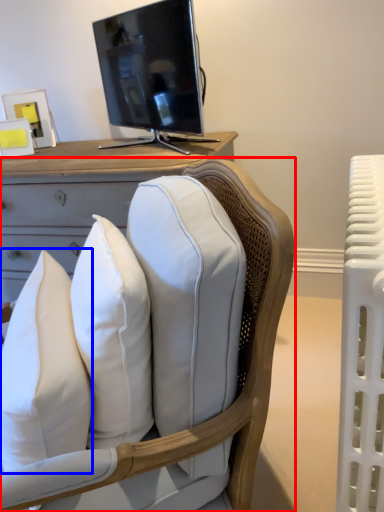
Question: Among these objects, which one is nearest to the camera, chair (highlighted by a red box) or pillow (highlighted by a blue box)?

Choices:
 (A) chair
 (B) pillow

Answer: (A)